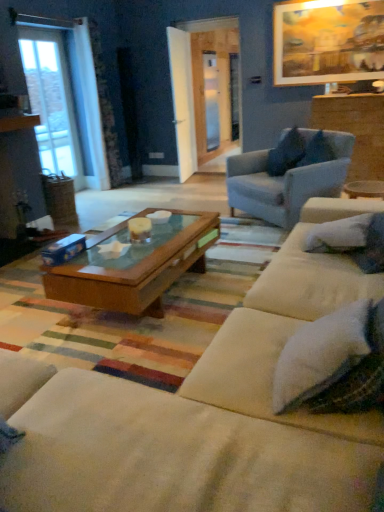
Question: Can you confirm if clear glass screen door at center, marked as the first screen door in a left-to-right arrangement, is positioned to the left of clear glass door at left?

Choices:
 (A) no
 (B) yes

Answer: (A)

Question: Is clear glass screen door at center, which ranks as the 2th screen door in back-to-front order, touching clear glass door at left?

Choices:
 (A) yes
 (B) no

Answer: (B)

Question: Is clear glass screen door at center, which ranks as the 2th screen door in back-to-front order, oriented away from clear glass door at left?

Choices:
 (A) no
 (B) yes

Answer: (A)

Question: Is clear glass screen door at center, acting as the 1th screen door starting from the front, not inside clear glass door at left?

Choices:
 (A) no
 (B) yes

Answer: (B)

Question: Does clear glass screen door at center, which ranks as the 2th screen door in back-to-front order, have a greater width compared to clear glass door at left?

Choices:
 (A) yes
 (B) no

Answer: (B)

Question: Is wooden picture frame at upper right inside the boundaries of clear glass door at left, or outside?

Choices:
 (A) inside
 (B) outside

Answer: (B)

Question: From the image's perspective, is wooden picture frame at upper right located above or below clear glass door at left?

Choices:
 (A) above
 (B) below

Answer: (A)

Question: Relative to clear glass door at left, is wooden picture frame at upper right in front or behind?

Choices:
 (A) front
 (B) behind

Answer: (A)

Question: In terms of size, does wooden picture frame at upper right appear bigger or smaller than clear glass door at left?

Choices:
 (A) small
 (B) big

Answer: (A)

Question: Is clear glass door at left bigger or smaller than white soft pillow at right, which ranks as the 1th pillow in bottom-to-top order?

Choices:
 (A) small
 (B) big

Answer: (B)

Question: Is clear glass door at left situated inside white soft pillow at right, which ranks as the 1th pillow in bottom-to-top order, or outside?

Choices:
 (A) inside
 (B) outside

Answer: (B)

Question: Considering the positions of point (38, 100) and point (337, 232), is point (38, 100) closer or farther from the camera than point (337, 232)?

Choices:
 (A) farther
 (B) closer

Answer: (A)

Question: Is clear glass door at left taller or shorter than white soft pillow at right, the second pillow viewed from the back?

Choices:
 (A) tall
 (B) short

Answer: (A)

Question: In the image, is white fabric couch at center positioned in front of or behind fluffy white pillow at right, placed as the 1th pillow when sorted from front to back?

Choices:
 (A) front
 (B) behind

Answer: (A)

Question: Looking at their shapes, would you say white fabric couch at center is wider or thinner than fluffy white pillow at right, positioned as the 2th pillow in bottom-to-top order?

Choices:
 (A) thin
 (B) wide

Answer: (B)